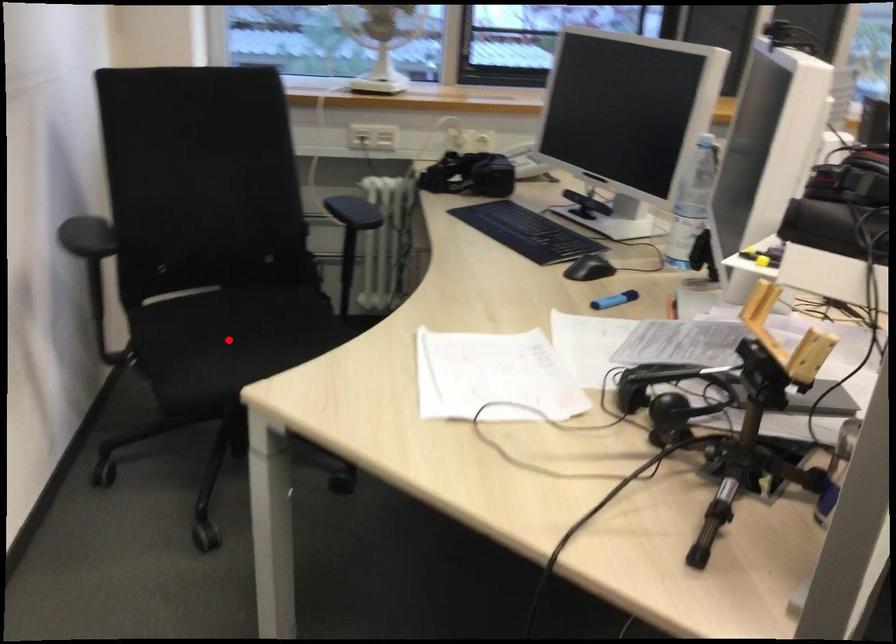
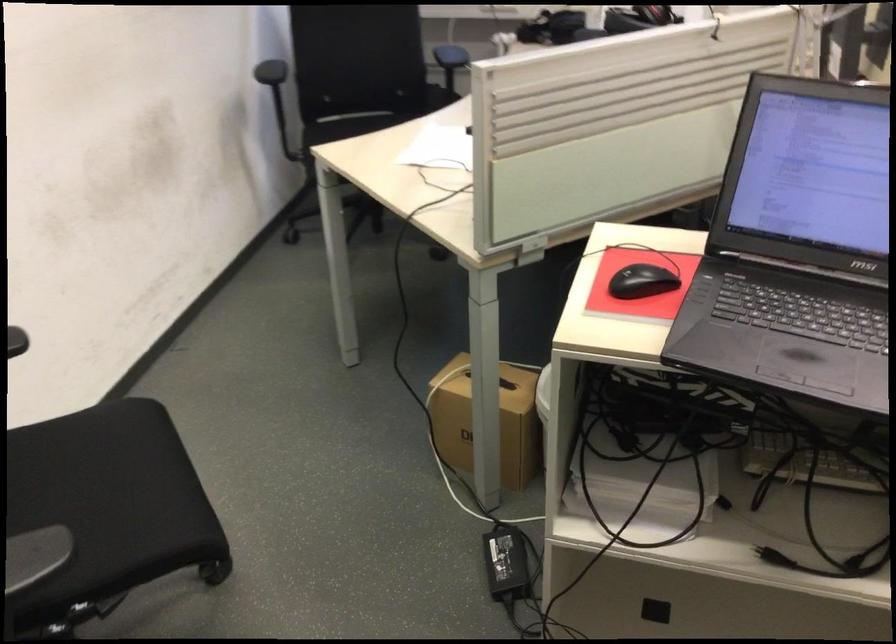
Question: I am providing you with two images of the same scene from different viewpoints. A red point is marked on the first image. Is the red point's position out of view in image 2?

Choices:
 (A) Yes
 (B) No

Answer: (A)